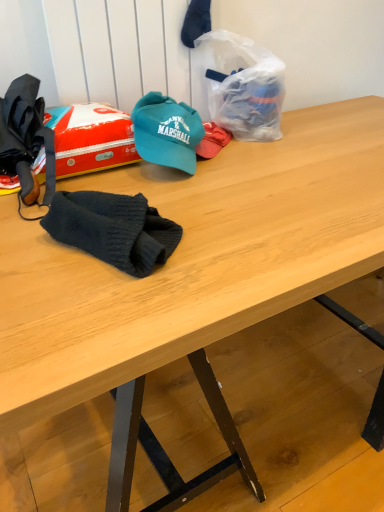
In order to face translucent plastic bag at upper center, should I rotate leftwards or rightwards?

A 7.525 degree turn to the right will do.

Measure the distance between translucent plastic bag at upper center and camera.

The depth of translucent plastic bag at upper center is 3.58 feet.

The width and height of the screenshot is (384, 512). Describe the element at coordinates (242, 85) in the screenshot. I see `translucent plastic bag at upper center` at that location.

What is the approximate height of translucent plastic bag at upper center?

It is 27.11 centimeters.

This screenshot has height=512, width=384. Find the location of `translucent plastic bag at upper center`. translucent plastic bag at upper center is located at coordinates (242, 85).

This screenshot has width=384, height=512. I want to click on translucent plastic bag at upper center, so click(242, 85).